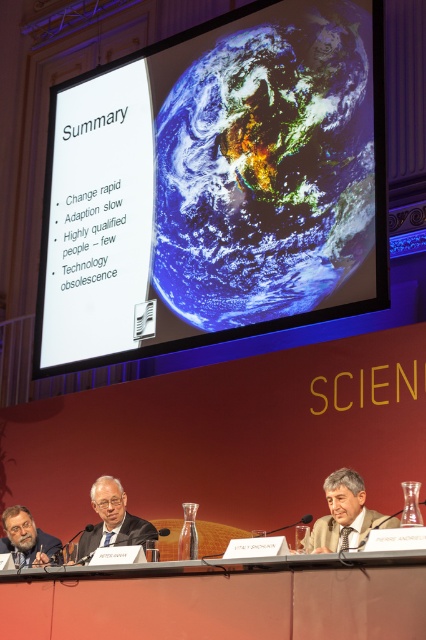
In the scene shown: Is matte wood table at lower center further to the viewer compared to gray hair at lower left?

No, matte wood table at lower center is closer to the viewer.

Is matte wood table at lower center positioned in front of gray hair at lower left?

Yes, matte wood table at lower center is closer to the viewer.

Which is behind, point (396, 580) or point (8, 512)?

Point (8, 512)

Locate an element on the screen. The height and width of the screenshot is (640, 426). matte wood table at lower center is located at coordinates (222, 600).

Is point (334, 492) behind point (46, 563)?

Yes, it is.

Is matte black man at center bigger than gray hair at lower left?

Indeed, matte black man at center has a larger size compared to gray hair at lower left.

What do you see at coordinates (345, 515) in the screenshot? Image resolution: width=426 pixels, height=640 pixels. I see `matte black man at center` at bounding box center [345, 515].

At what (x,y) coordinates should I click in order to perform the action: click on matte black man at center. Please return your answer as a coordinate pair (x, y). The height and width of the screenshot is (640, 426). Looking at the image, I should click on (345, 515).

Which is in front, point (88, 204) or point (32, 609)?

Point (32, 609)

Identify the location of white paper at center. The image size is (426, 640). (215, 186).